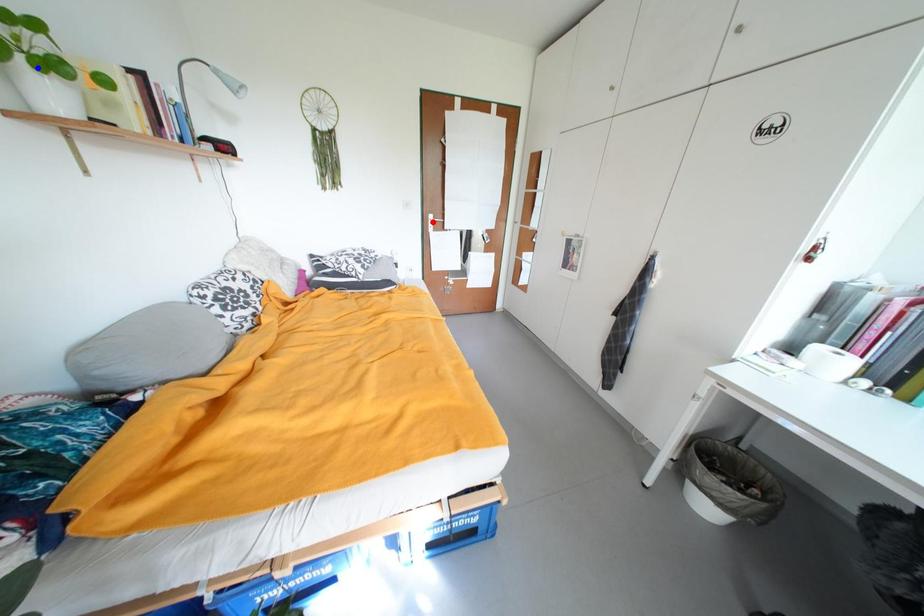
Question: Which of the two points in the image is closer to the camera?

Choices:
 (A) Blue point is closer.
 (B) Red point is closer.

Answer: (A)